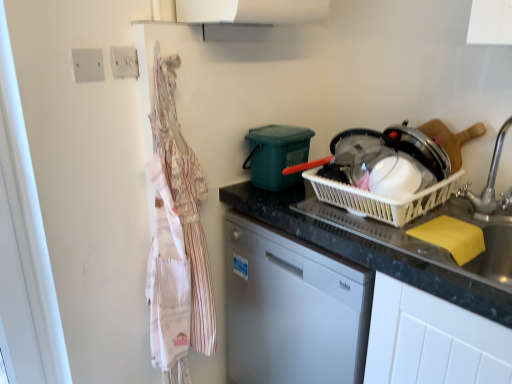
Question: Does white plastic electric outlet at upper left, the second electric outlet when ordered from front to back, lie behind yellow sponge at sink?

Choices:
 (A) yes
 (B) no

Answer: (A)

Question: Considering the relative sizes of white plastic electric outlet at upper left, which is the second electric outlet in left-to-right order, and yellow sponge at sink in the image provided, is white plastic electric outlet at upper left, which is the second electric outlet in left-to-right order, shorter than yellow sponge at sink?

Choices:
 (A) yes
 (B) no

Answer: (A)

Question: Does white plastic electric outlet at upper left, which is the second electric outlet in left-to-right order, have a smaller size compared to yellow sponge at sink?

Choices:
 (A) yes
 (B) no

Answer: (A)

Question: From the image's perspective, is white plastic electric outlet at upper left, the second electric outlet when ordered from front to back, on top of yellow sponge at sink?

Choices:
 (A) no
 (B) yes

Answer: (B)

Question: Can you confirm if white plastic electric outlet at upper left, the first electric outlet viewed from the back, is positioned to the right of yellow sponge at sink?

Choices:
 (A) no
 (B) yes

Answer: (A)

Question: Visually, is striped cotton apron at left positioned to the left or to the right of black granite countertop at center?

Choices:
 (A) right
 (B) left

Answer: (B)

Question: Is point [196, 291] closer or farther from the camera than point [308, 231]?

Choices:
 (A) closer
 (B) farther

Answer: (B)

Question: Choose the correct answer: Is striped cotton apron at left inside black granite countertop at center or outside it?

Choices:
 (A) inside
 (B) outside

Answer: (B)

Question: From a real-world perspective, is striped cotton apron at left above or below black granite countertop at center?

Choices:
 (A) below
 (B) above

Answer: (B)

Question: Considering their positions, is white plastic electric outlet at upper left, the 2th electric outlet when ordered from right to left, located in front of or behind silver metallic faucet at right?

Choices:
 (A) behind
 (B) front

Answer: (A)

Question: In the image, is white plastic electric outlet at upper left, the 2th electric outlet when ordered from right to left, on the left side or the right side of silver metallic faucet at right?

Choices:
 (A) left
 (B) right

Answer: (A)

Question: From the image's perspective, is white plastic electric outlet at upper left, which is counted as the first electric outlet, starting from the left, located above or below silver metallic faucet at right?

Choices:
 (A) below
 (B) above

Answer: (B)

Question: From a real-world perspective, is white plastic electric outlet at upper left, the 1th electric outlet from the front, above or below silver metallic faucet at right?

Choices:
 (A) above
 (B) below

Answer: (A)

Question: Is white plastic basket at center bigger or smaller than white plastic electric outlet at upper left, which is the second electric outlet in left-to-right order?

Choices:
 (A) big
 (B) small

Answer: (A)

Question: Is point (409, 203) closer or farther from the camera than point (135, 66)?

Choices:
 (A) farther
 (B) closer

Answer: (B)